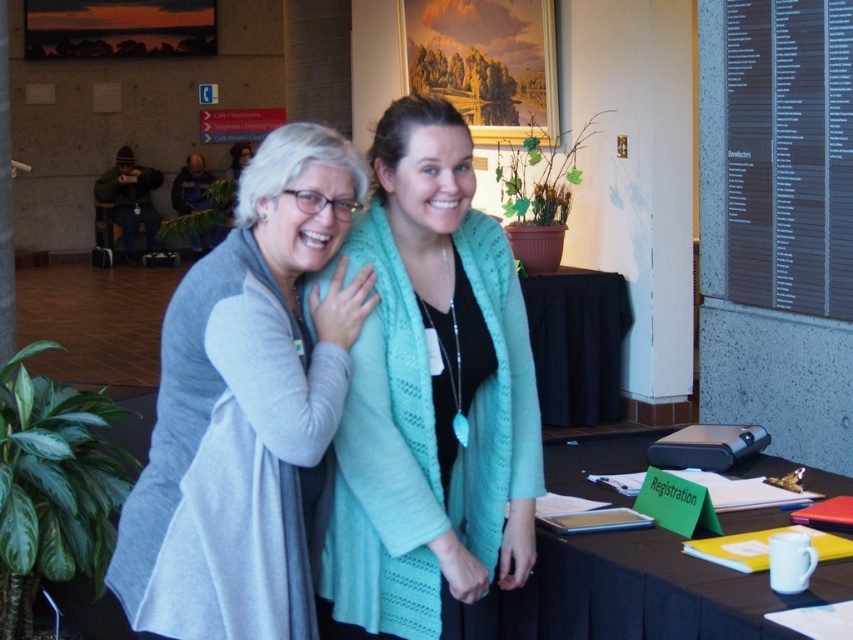
You are organizing an event and need to place a 4 meter long banner between the teal knitted cardigan at center and the black fabric table at center. Is there enough space between them to fit the banner?

The teal knitted cardigan at center is 3.82 meters from the black fabric table at center. Since the banner is 4 meters long, there is not enough space between them to fit the banner.